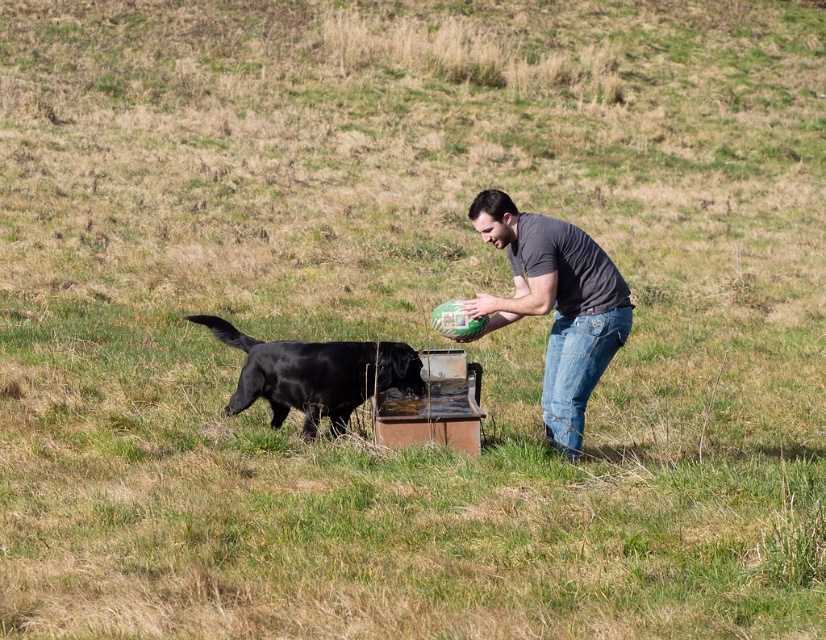
Question: Is gray matte shirt at center above black glossy fur at left?

Choices:
 (A) yes
 (B) no

Answer: (A)

Question: Does gray matte shirt at center appear under black glossy fur at left?

Choices:
 (A) no
 (B) yes

Answer: (A)

Question: Which point is farther from the camera taking this photo?

Choices:
 (A) (559, 310)
 (B) (416, 390)

Answer: (B)

Question: Is gray matte shirt at center closer to the viewer compared to black glossy fur at left?

Choices:
 (A) no
 (B) yes

Answer: (B)